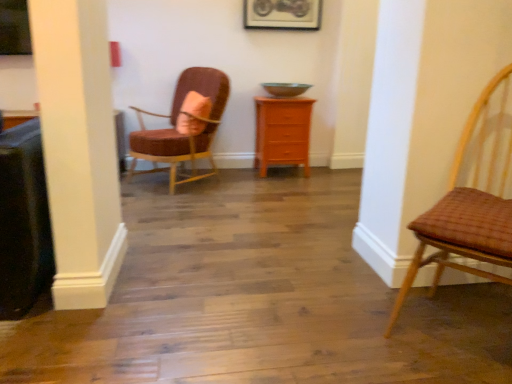
Question: Considering the positions of orange wood chest of drawers at center and metallic silver picture frame at upper center in the image, is orange wood chest of drawers at center taller or shorter than metallic silver picture frame at upper center?

Choices:
 (A) tall
 (B) short

Answer: (A)

Question: In the image, is orange wood chest of drawers at center on the left side or the right side of metallic silver picture frame at upper center?

Choices:
 (A) left
 (B) right

Answer: (B)

Question: Estimate the real-world distances between objects in this image. Which object is closer to the orange wood chest of drawers at center?

Choices:
 (A) velvet pink chair at upper left, the first chair from the left
 (B) woven brown chair at right, the second chair viewed from the back
 (C) pink fabric pillow at center
 (D) metallic silver picture frame at upper center

Answer: (A)

Question: Which object is the closest to the woven brown chair at right, the first chair when ordered from front to back?

Choices:
 (A) metallic silver picture frame at upper center
 (B) velvet pink chair at upper left, which is the second chair from right to left
 (C) orange wood chest of drawers at center
 (D) pink fabric pillow at center

Answer: (C)